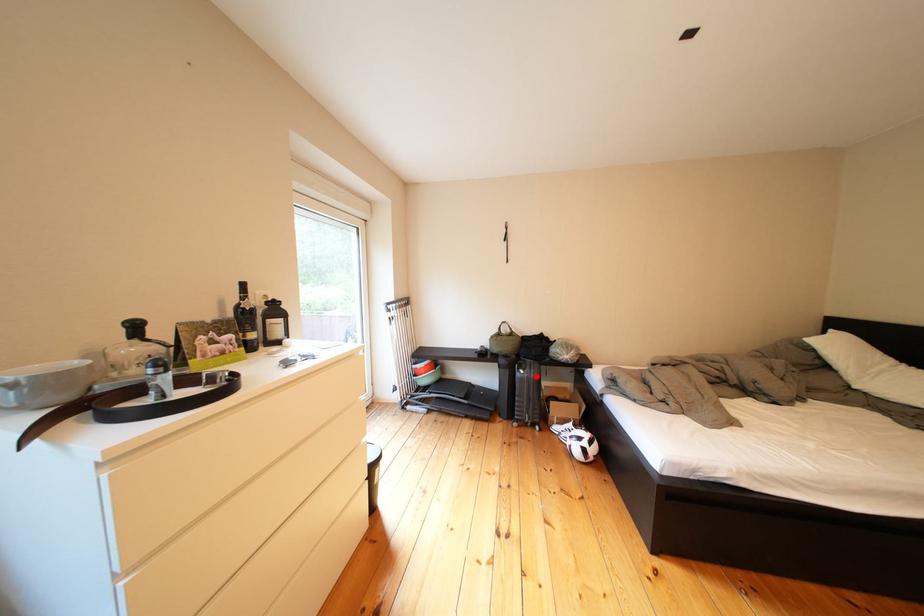
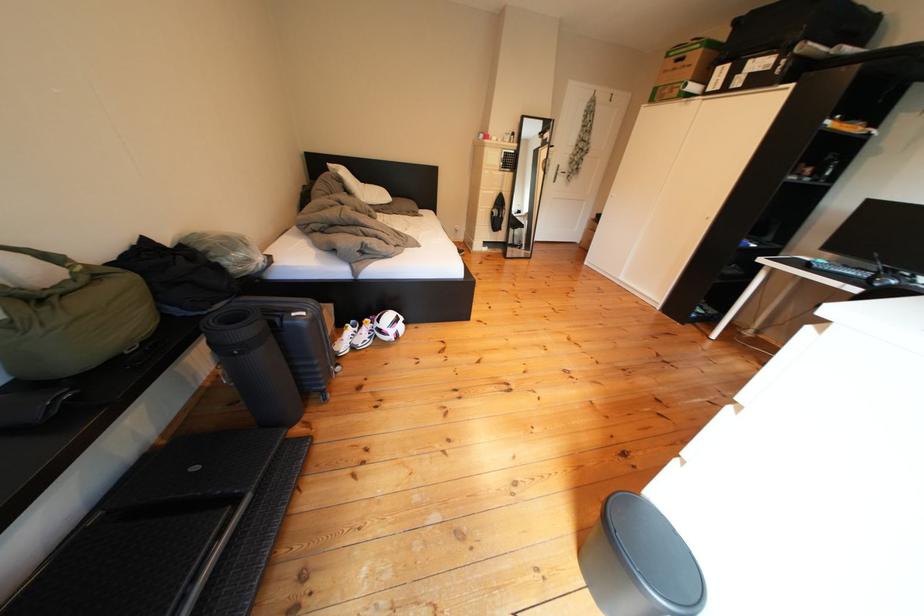
Question: I am providing you with two images of the same scene from different viewpoints. In image1, a red point is highlighted. Considering the same 3D point in image2, which of the following is correct?

Choices:
 (A) It is closer
 (B) It is farther

Answer: (A)